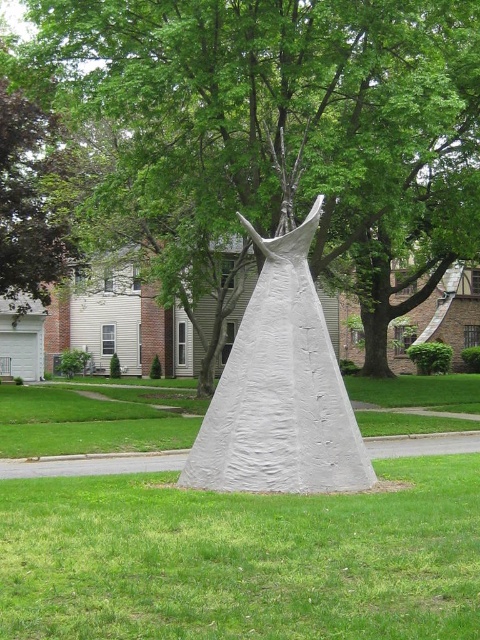
You are standing in the park and want to take a photo of the white textured cone at center. There is a green leafy tree at center in the way. Can you move to the side to avoid the tree and still see the cone?

The green leafy tree at center is further to the viewer than white textured cone at center, so moving to the side would allow you to avoid the tree while still seeing the cone behind it.

You are a photographer planning to take a photo of the white textured cone at center and the white matte dress at center. Since both are white, you want to ensure they are distinguishable in the photo. Which object should you focus on first to capture their distinct features?

The white textured cone at center is larger in size than the white matte dress at center, so focusing on the white textured cone at center first will allow you to capture its larger size and textured surface details more clearly.

You are standing in the park and see the green leafy tree at center and the white matte dress at center. Which object is closer to you?

The green leafy tree at center is closer to you because the white matte dress at center is behind it.